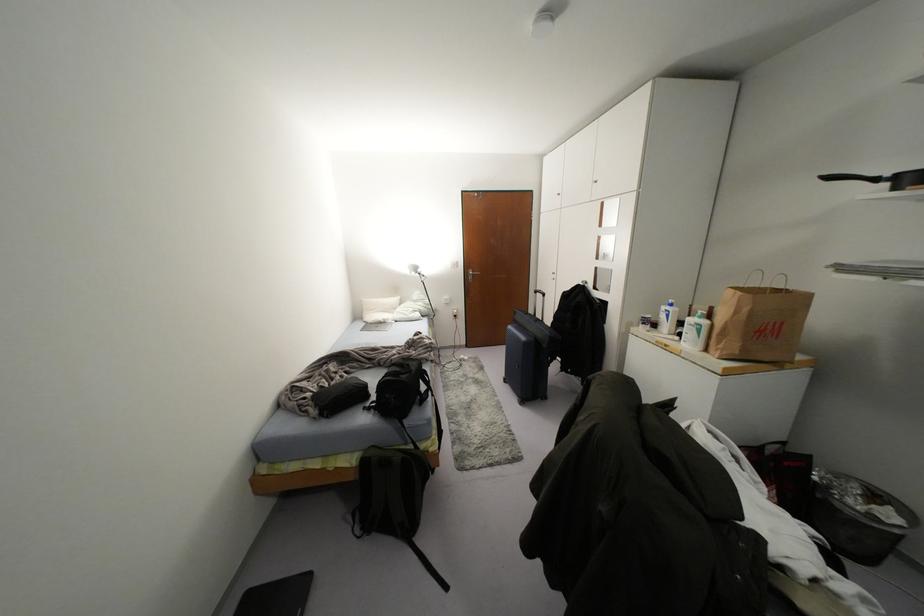
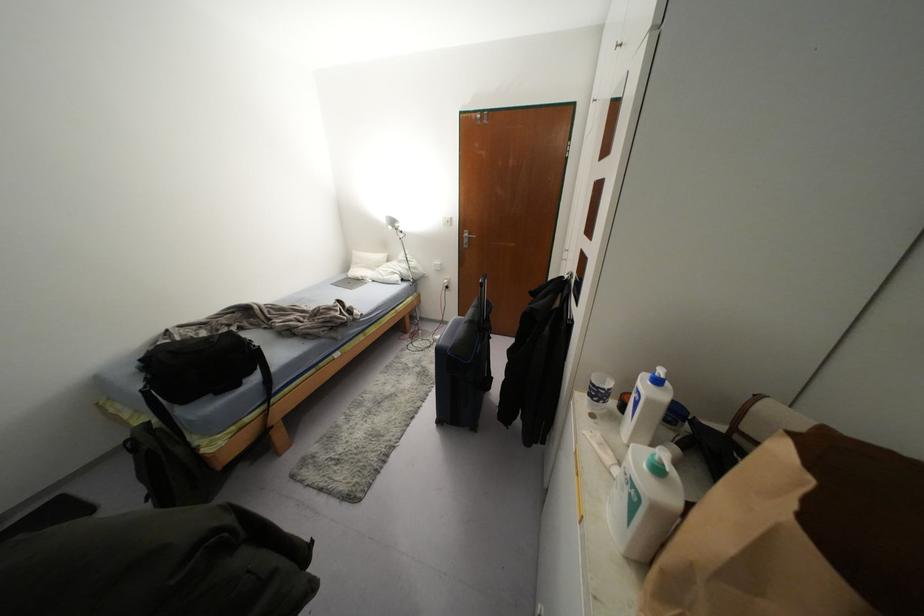
Find the pixel in the second image that matches (x=698, y=330) in the first image.

(633, 505)